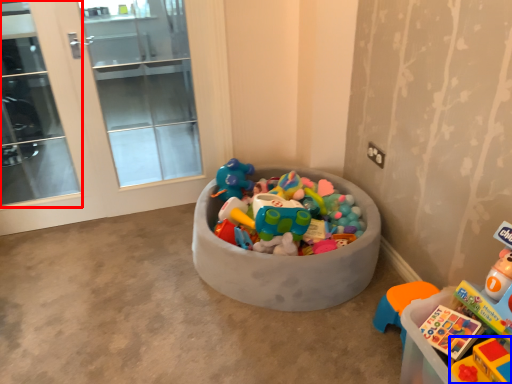
Question: Which object is closer to the camera taking this photo, screen door (highlighted by a red box) or toy (highlighted by a blue box)?

Choices:
 (A) screen door
 (B) toy

Answer: (B)